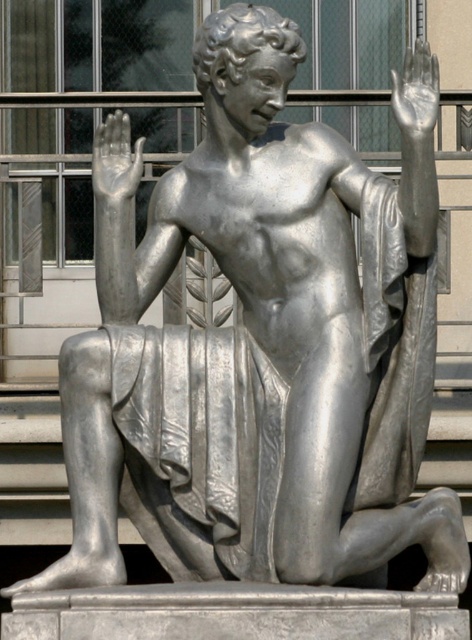
Is silver metallic hand at upper left closer to camera compared to metallic silver hand at upper right?

No, it is behind metallic silver hand at upper right.

Which is behind, point (126, 164) or point (401, 81)?

Positioned behind is point (126, 164).

Which is in front, point (125, 120) or point (413, 83)?

Point (413, 83) is more forward.

You are a GUI agent. You are given a task and a screenshot of the screen. Output one action in this format:
    pyautogui.click(x=<x>, y=<y>)
    Task: Click on the silver metallic hand at upper left
    The image size is (472, 640).
    Given the screenshot: What is the action you would take?
    pyautogui.click(x=116, y=161)